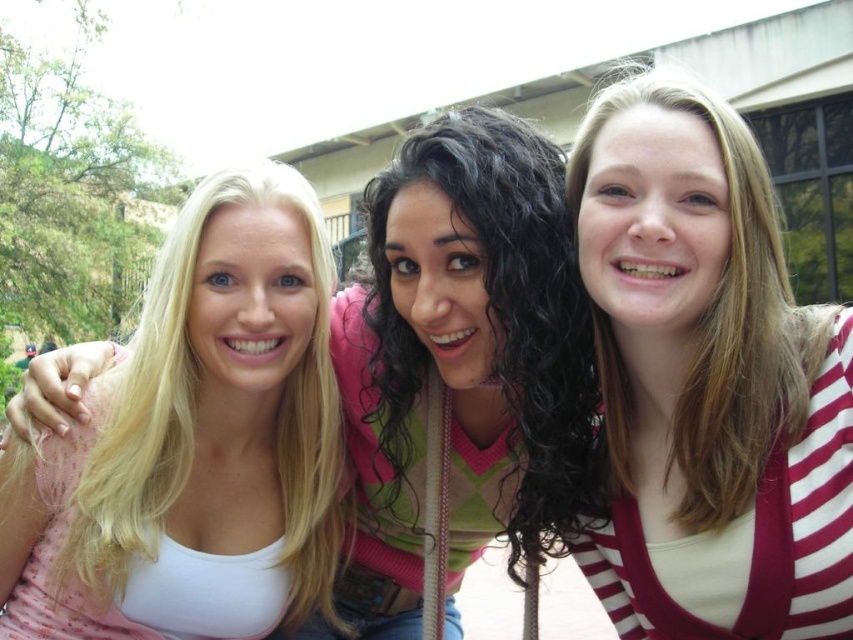
You are a photographer trying to capture a clear shot of the white striped cardigan at center and the blonde hair at left. Which one should you focus on to ensure it appears sharper in the photo?

The white striped cardigan at center is closer to the viewer than the blonde hair at left, so focusing on the white striped cardigan at center will make it appear sharper in the photo.

You are trying to decide which item to pack for a photoshoot. You have a limited space in your bag. Given the white striped cardigan at center and the blonde hair at left, which item takes up more space?

The white striped cardigan at center takes up more space because its width is larger than the blonde hair at left.

You are a photographer trying to capture a group photo of the three people in the scene. You notice the white striped cardigan at center and the blonde hair at left. Which of these two items is positioned higher up in the image?

The white striped cardigan at center is taller than the blonde hair at left, so it is positioned higher up in the image.